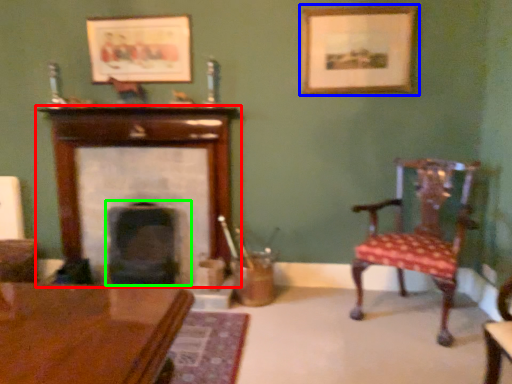
Question: Based on their relative distances, which object is farther from fireplace (highlighted by a red box)? Choose from picture frame (highlighted by a blue box) and fireplace (highlighted by a green box).

Choices:
 (A) picture frame
 (B) fireplace

Answer: (A)